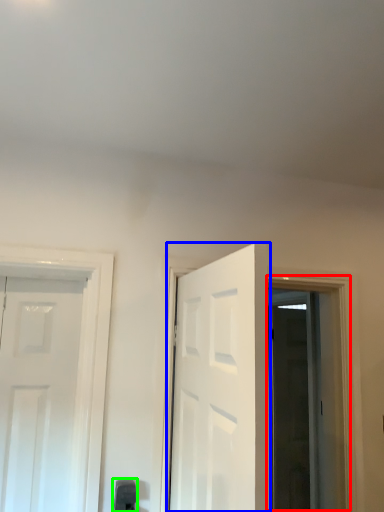
Question: Which is nearer to the window (highlighted by a red box)? door (highlighted by a blue box) or door handle (highlighted by a green box).

Choices:
 (A) door
 (B) door handle

Answer: (A)